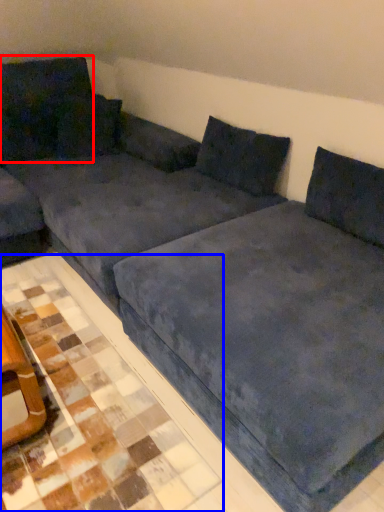
Question: Among these objects, which one is farthest to the camera, pillow (highlighted by a red box) or tile (highlighted by a blue box)?

Choices:
 (A) pillow
 (B) tile

Answer: (A)